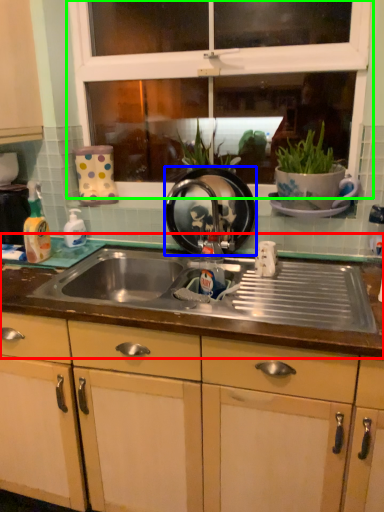
Question: Considering the real-world distances, which object is farthest from countertop (highlighted by a red box)? appliance (highlighted by a blue box) or window (highlighted by a green box)?

Choices:
 (A) appliance
 (B) window

Answer: (B)